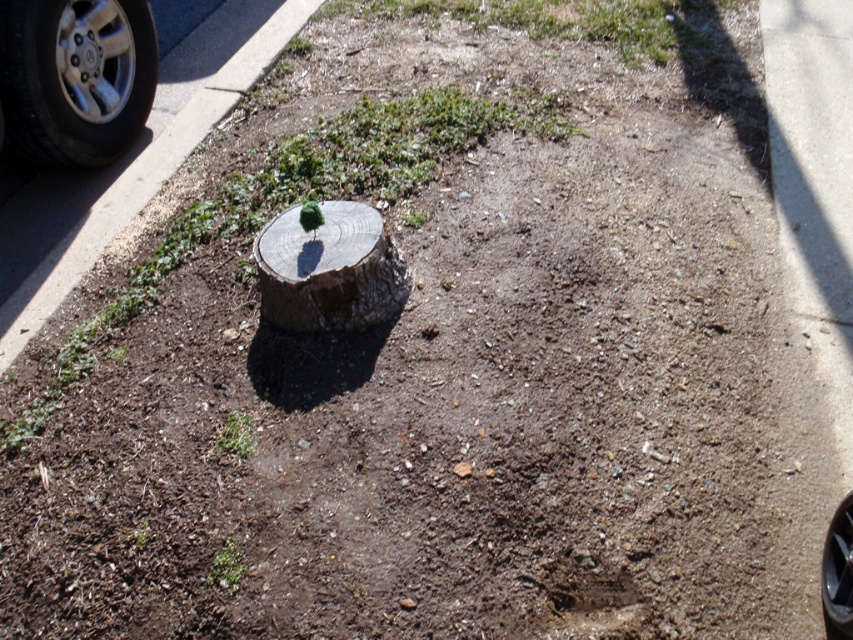
Question: Estimate the real-world distances between objects in this image. Which object is farther from the black rubber tire at lower right?

Choices:
 (A) smooth brown tree stump at center
 (B) silver metallic tire at upper left

Answer: (B)

Question: Which of the following is the closest to the observer?

Choices:
 (A) (155, 38)
 (B) (383, 252)
 (C) (833, 564)

Answer: (C)

Question: Is smooth brown tree stump at center below black rubber tire at lower right?

Choices:
 (A) no
 (B) yes

Answer: (A)

Question: Does silver metallic tire at upper left have a smaller size compared to black rubber tire at lower right?

Choices:
 (A) no
 (B) yes

Answer: (A)

Question: Which object is positioned farthest from the silver metallic tire at upper left?

Choices:
 (A) smooth brown tree stump at center
 (B) black rubber tire at lower right

Answer: (B)

Question: Where is silver metallic tire at upper left located in relation to smooth brown tree stump at center in the image?

Choices:
 (A) below
 (B) above

Answer: (B)